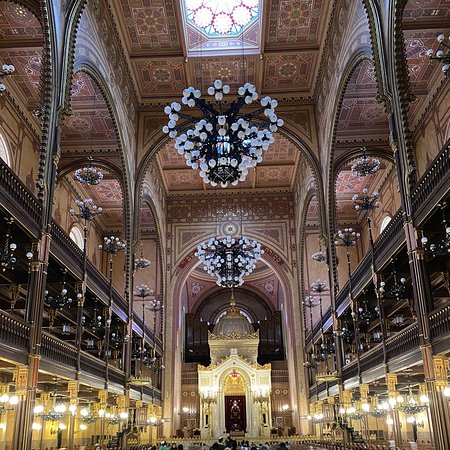
Find the location of `circle in stained glass skylight`. circle in stained glass skylight is located at coordinates [201, 17], [223, 22], [241, 15].